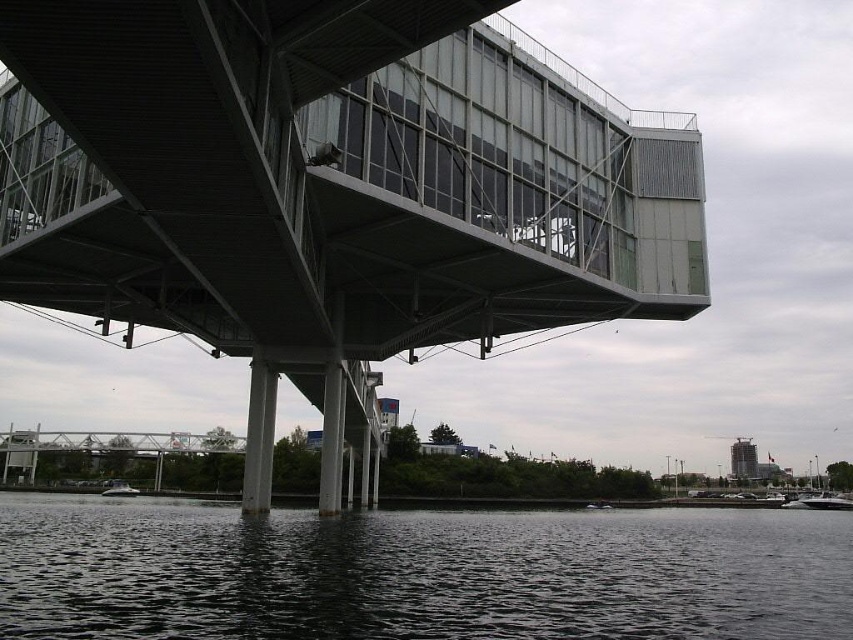
Question: Where is metallic gray bridge at upper center located in relation to white glossy boat at lower right in the image?

Choices:
 (A) left
 (B) right

Answer: (A)

Question: Is metallic gray bridge at upper center above dark water at lower center?

Choices:
 (A) no
 (B) yes

Answer: (B)

Question: Among these points, which one is nearest to the camera?

Choices:
 (A) (128, 490)
 (B) (809, 504)

Answer: (A)

Question: Can you confirm if dark water at lower center is thinner than white glossy boat at lower right?

Choices:
 (A) no
 (B) yes

Answer: (A)

Question: Which point appears farthest from the camera in this image?

Choices:
 (A) (425, 260)
 (B) (271, 627)

Answer: (A)

Question: Which point is farther to the camera?

Choices:
 (A) (412, 35)
 (B) (126, 483)
 (C) (820, 493)
 (D) (503, 625)

Answer: (C)